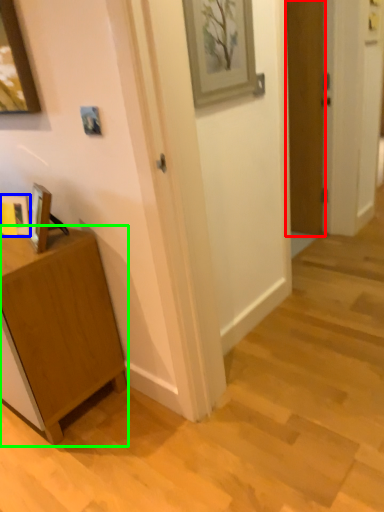
Question: Estimate the real-world distances between objects in this image. Which object is closer to door (highlighted by a red box), picture frame (highlighted by a blue box) or cabinetry (highlighted by a green box)?

Choices:
 (A) picture frame
 (B) cabinetry

Answer: (B)